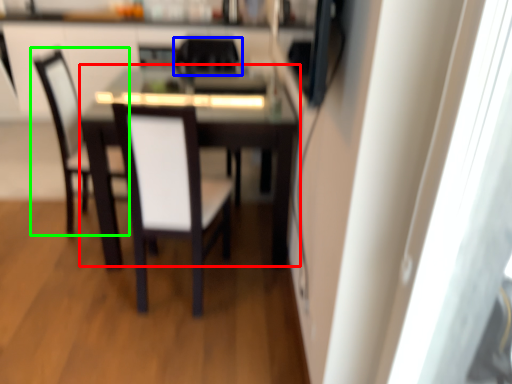
Question: Which is farther away from table (highlighted by a red box)? chair (highlighted by a blue box) or chair (highlighted by a green box)?

Choices:
 (A) chair
 (B) chair

Answer: (B)